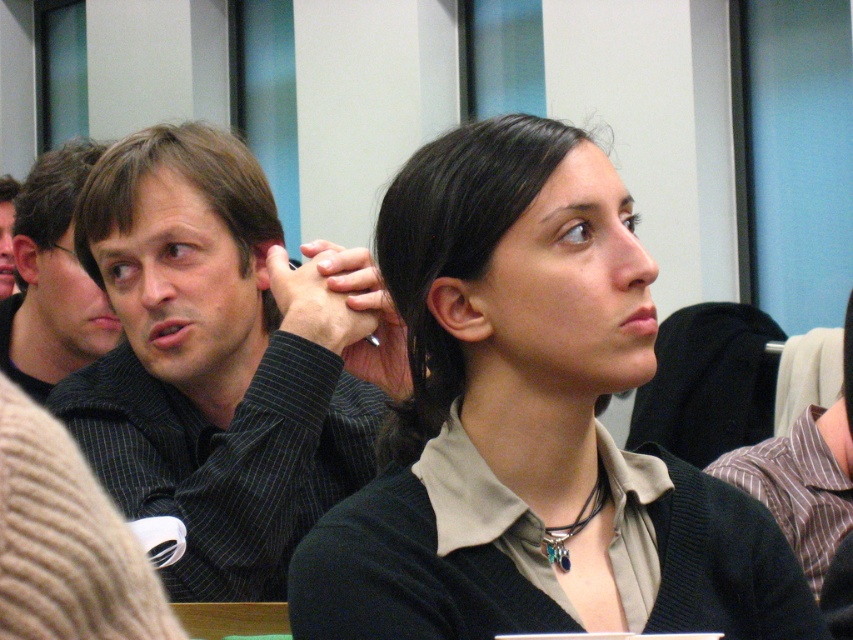
Which is behind, point (488, 390) or point (115, 460)?

Point (115, 460)

Locate an element on the screen. This screenshot has height=640, width=853. matte black sweater at center is located at coordinates (531, 426).

Where is `matte black sweater at center`? The width and height of the screenshot is (853, 640). matte black sweater at center is located at coordinates (531, 426).

Can you confirm if matte black sweater at center is positioned above matte black shirt at upper left?

Actually, matte black sweater at center is below matte black shirt at upper left.

Does matte black sweater at center have a smaller size compared to matte black shirt at upper left?

Incorrect, matte black sweater at center is not smaller in size than matte black shirt at upper left.

Is point (386, 515) farther from viewer compared to point (4, 269)?

No, it is not.

This screenshot has width=853, height=640. What are the coordinates of `matte black sweater at center` in the screenshot? It's located at (531, 426).

Does point (51, 371) come in front of point (0, 298)?

Yes, it is.

How distant is dark gray striped shirt at center from matte black shirt at upper left?

dark gray striped shirt at center is 39.20 inches away from matte black shirt at upper left.

Identify the location of dark gray striped shirt at center. Image resolution: width=853 pixels, height=640 pixels. (51, 280).